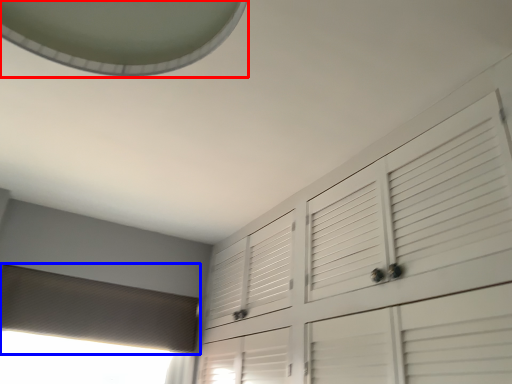
Question: Which object appears closest to the camera in this image, exhaust hood (highlighted by a red box) or blind (highlighted by a blue box)?

Choices:
 (A) exhaust hood
 (B) blind

Answer: (A)